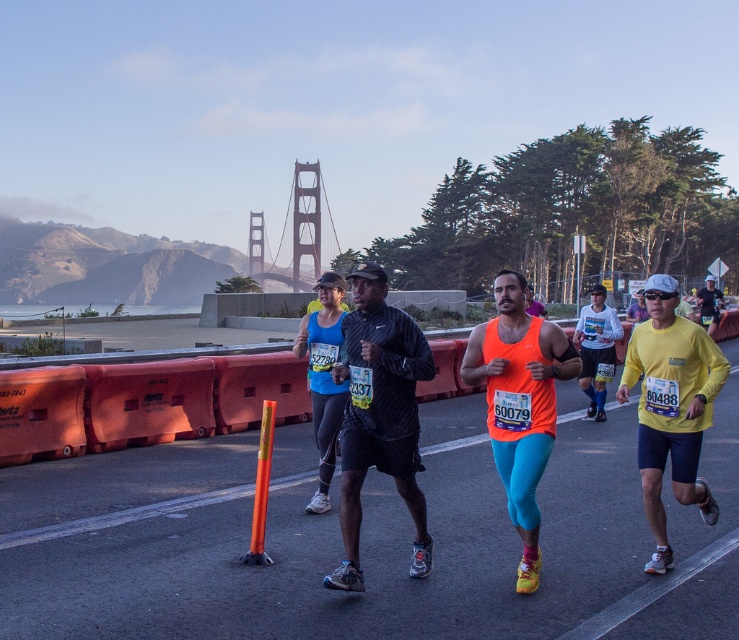
Is yellow fabric shirt at right bigger than metallic bridge at upper center?

No, yellow fabric shirt at right is not bigger than metallic bridge at upper center.

Which of these two, yellow fabric shirt at right or metallic bridge at upper center, stands shorter?

Standing shorter between the two is yellow fabric shirt at right.

Does point (658, 440) come closer to viewer compared to point (289, 273)?

That is True.

Where is `yellow fabric shirt at right`? Image resolution: width=739 pixels, height=640 pixels. yellow fabric shirt at right is located at coordinates (670, 406).